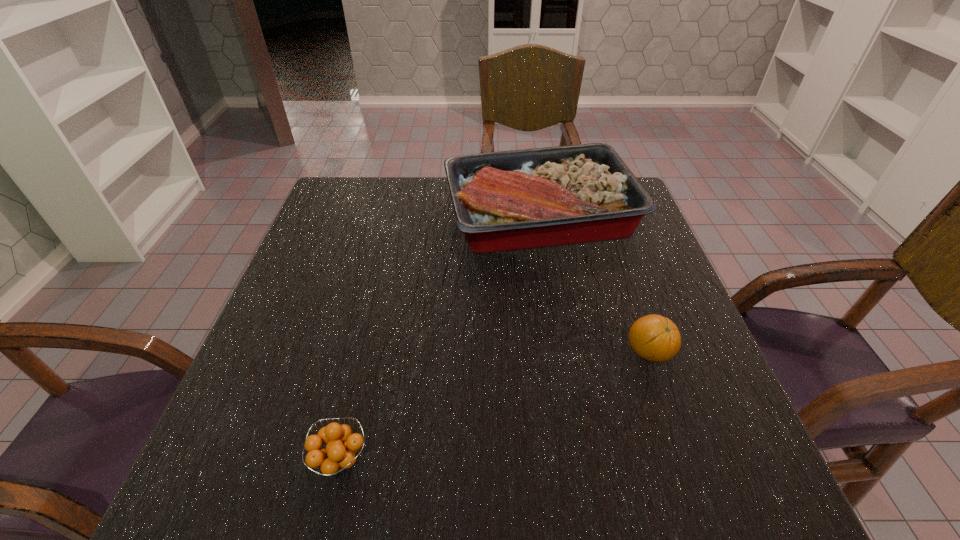
At what (x,y) coordinates should I click in order to perform the action: click on the closest object relative to the taller orange fruit. Please return your answer as a coordinate pair (x, y). The image size is (960, 540). Looking at the image, I should click on (510, 200).